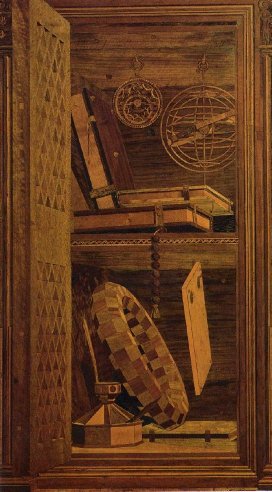
You are a GUI agent. You are given a task and a screenshot of the screen. Output one action in this format:
    pyautogui.click(x=<x>, y=<y>)
    Task: Click on the tassle
    
    Given the screenshot: What is the action you would take?
    pyautogui.click(x=155, y=263)